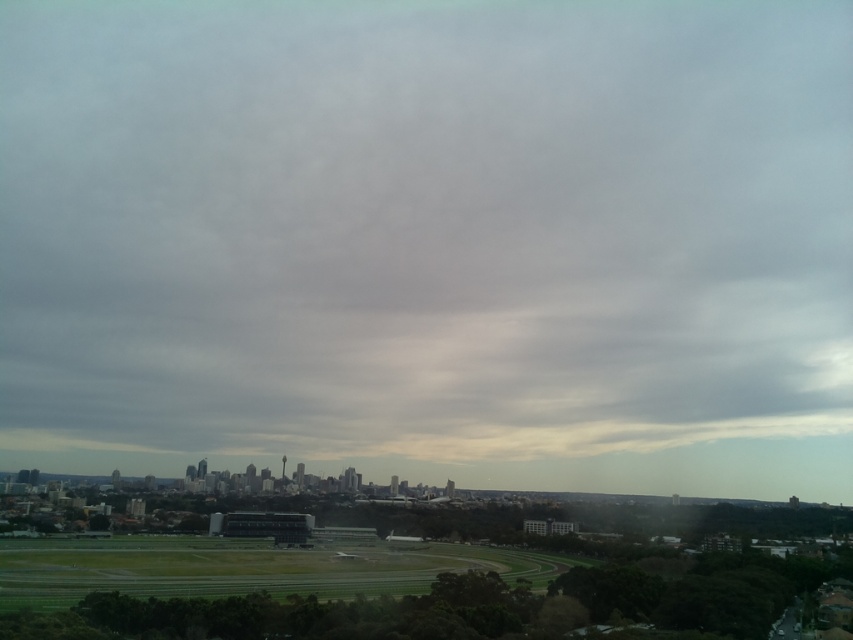
Question: In this image, where is gray fluffy cloud at upper center located relative to green grass football field at lower left?

Choices:
 (A) below
 (B) above

Answer: (B)

Question: Which point is closer to the camera?

Choices:
 (A) (828, 348)
 (B) (485, 561)

Answer: (B)

Question: Which object is farther from the camera taking this photo?

Choices:
 (A) gray fluffy cloud at upper center
 (B) green grass football field at lower left

Answer: (A)

Question: Observing the image, what is the correct spatial positioning of gray fluffy cloud at upper center in reference to green grass football field at lower left?

Choices:
 (A) above
 (B) below

Answer: (A)

Question: Does gray fluffy cloud at upper center appear on the right side of green grass football field at lower left?

Choices:
 (A) yes
 (B) no

Answer: (A)